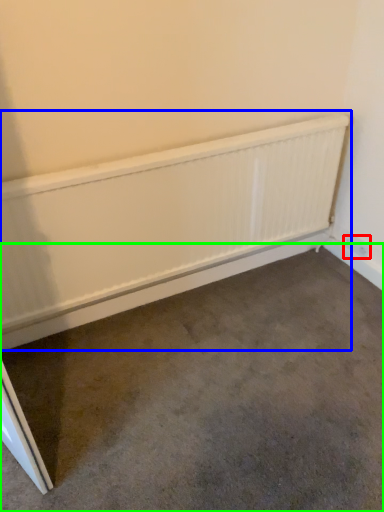
Question: Which object is positioned closest to electric outlet (highlighted by a red box)? Select from radiator (highlighted by a blue box) and concrete (highlighted by a green box).

Choices:
 (A) radiator
 (B) concrete

Answer: (A)